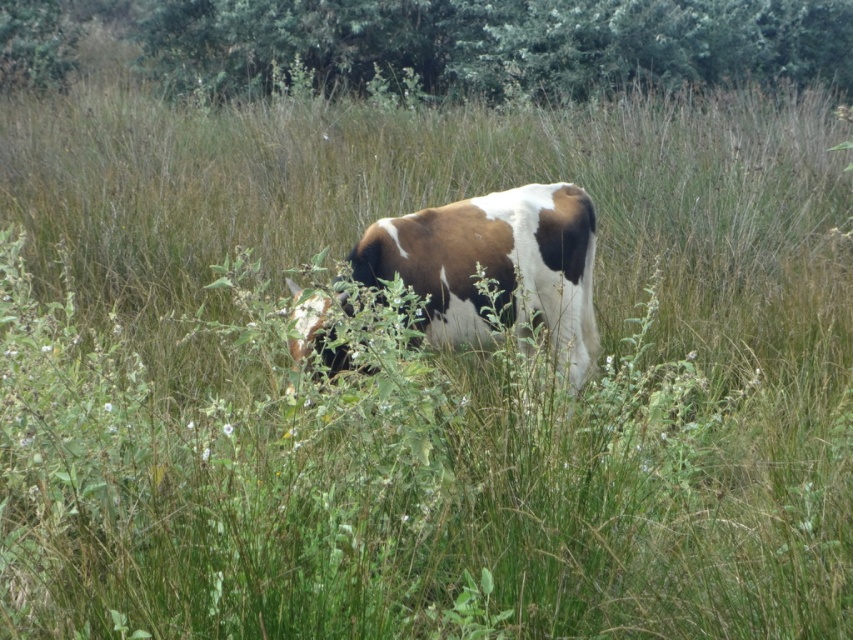
Can you confirm if green leafy tree at upper center is positioned above brown and white fur at center?

Yes.

Who is lower down, green leafy tree at upper center or brown and white fur at center?

Positioned lower is brown and white fur at center.

Does point (663, 1) lie behind point (558, 355)?

Yes, point (663, 1) is farther from viewer.

Find the location of a particular element. This screenshot has width=853, height=640. green leafy tree at upper center is located at coordinates pos(445,42).